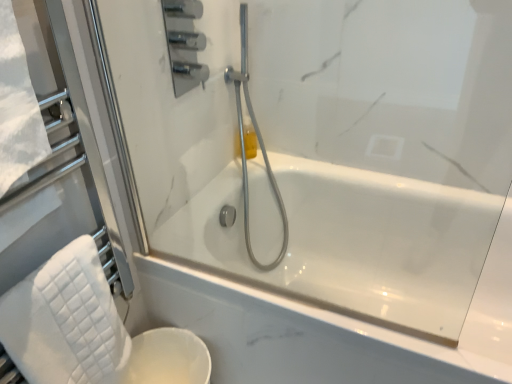
Question: Considering the relative sizes of white quilted towel at lower left and satin chrome shower head at center in the image provided, is white quilted towel at lower left taller than satin chrome shower head at center?

Choices:
 (A) yes
 (B) no

Answer: (B)

Question: From the image's perspective, is white quilted towel at lower left below satin chrome shower head at center?

Choices:
 (A) yes
 (B) no

Answer: (A)

Question: Is the position of white quilted towel at lower left more distant than that of satin chrome shower head at center?

Choices:
 (A) no
 (B) yes

Answer: (A)

Question: Can you confirm if white quilted towel at lower left is wider than satin chrome shower head at center?

Choices:
 (A) no
 (B) yes

Answer: (A)

Question: Is satin chrome shower head at center inside white quilted towel at lower left?

Choices:
 (A) no
 (B) yes

Answer: (A)

Question: Can we say white quilted towel at lower left lies outside satin chrome shower head at center?

Choices:
 (A) yes
 (B) no

Answer: (A)

Question: Are white glossy toilet bowl at lower left and satin chrome shower head at center making contact?

Choices:
 (A) no
 (B) yes

Answer: (A)

Question: From a real-world perspective, is white glossy toilet bowl at lower left under satin chrome shower head at center?

Choices:
 (A) yes
 (B) no

Answer: (A)

Question: Does white glossy toilet bowl at lower left have a lesser height compared to satin chrome shower head at center?

Choices:
 (A) no
 (B) yes

Answer: (B)

Question: Is the position of white glossy toilet bowl at lower left more distant than that of satin chrome shower head at center?

Choices:
 (A) yes
 (B) no

Answer: (B)

Question: Does white glossy toilet bowl at lower left have a greater height compared to satin chrome shower head at center?

Choices:
 (A) yes
 (B) no

Answer: (B)

Question: From the image's perspective, would you say white glossy toilet bowl at lower left is positioned over satin chrome shower head at center?

Choices:
 (A) no
 (B) yes

Answer: (A)

Question: Does white glossy toilet bowl at lower left have a lesser height compared to translucent yellow bottle at upper center?

Choices:
 (A) yes
 (B) no

Answer: (B)